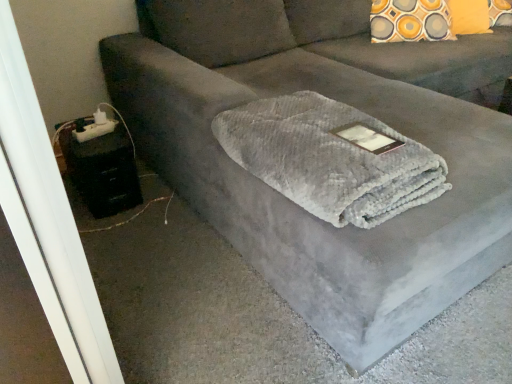
Question: Is point (64, 132) closer or farther from the camera than point (231, 158)?

Choices:
 (A) closer
 (B) farther

Answer: (B)

Question: Do you think black plastic table at lower left is within gray plush blanket at center, or outside of it?

Choices:
 (A) inside
 (B) outside

Answer: (B)

Question: From the image's perspective, relative to gray plush blanket at center, is black plastic table at lower left above or below?

Choices:
 (A) below
 (B) above

Answer: (A)

Question: Considering the positions of gray plush blanket at center and black plastic table at lower left in the image, is gray plush blanket at center wider or thinner than black plastic table at lower left?

Choices:
 (A) wide
 (B) thin

Answer: (A)

Question: From a real-world perspective, is gray plush blanket at center positioned above or below black plastic table at lower left?

Choices:
 (A) below
 (B) above

Answer: (B)

Question: Is gray plush blanket at center to the left or to the right of black plastic table at lower left in the image?

Choices:
 (A) left
 (B) right

Answer: (B)

Question: Is gray plush blanket at center bigger or smaller than black plastic table at lower left?

Choices:
 (A) small
 (B) big

Answer: (B)